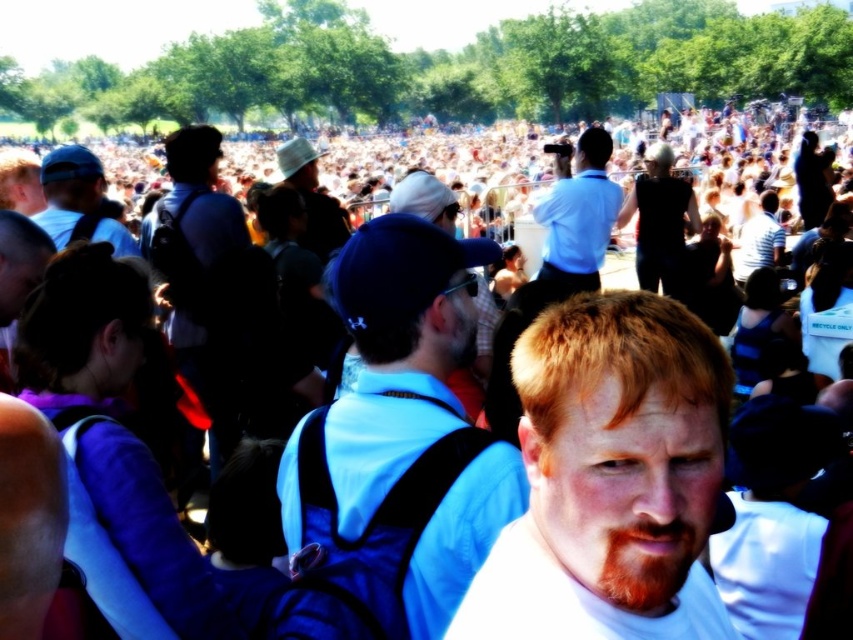
Does matte blue cap at upper left have a lesser width compared to white hat at center?

Incorrect, matte blue cap at upper left's width is not less than white hat at center's.

Consider the image. Can you confirm if matte blue cap at upper left is positioned below white hat at center?

Yes.

Image resolution: width=853 pixels, height=640 pixels. I want to click on matte blue cap at upper left, so 68,192.

Does light brown hair at center have a lesser height compared to dark blue backpack at center?

Yes, light brown hair at center is shorter than dark blue backpack at center.

Can you confirm if light brown hair at center is positioned to the left of dark blue backpack at center?

No, light brown hair at center is not to the left of dark blue backpack at center.

Who is more distant from viewer, [616,294] or [178,209]?

Positioned behind is point [178,209].

Where is `light brown hair at center`? The image size is (853, 640). light brown hair at center is located at coordinates (610, 477).

Is reddish-brown stubble at center below white hat at center?

Yes, reddish-brown stubble at center is below white hat at center.

Does reddish-brown stubble at center appear on the right side of white hat at center?

Yes, reddish-brown stubble at center is to the right of white hat at center.

This screenshot has width=853, height=640. Identify the location of reddish-brown stubble at center. (647, 563).

At what (x,y) coordinates should I click in order to perform the action: click on reddish-brown stubble at center. Please return your answer as a coordinate pair (x, y). The image size is (853, 640). Looking at the image, I should click on (647, 563).